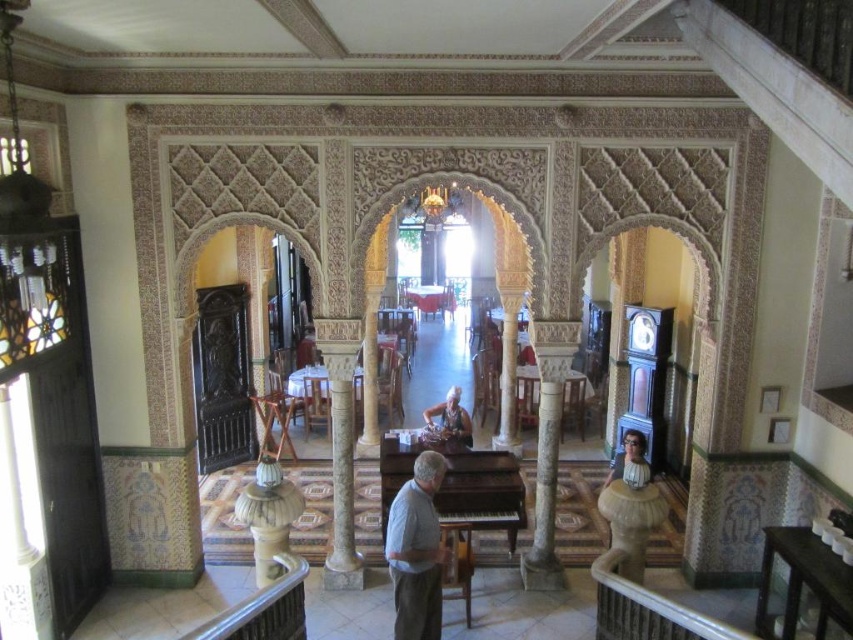
Question: Is gray cotton shirt at center wider than matte gray shirt at lower right?

Choices:
 (A) yes
 (B) no

Answer: (A)

Question: Does matte brown hair at center have a smaller size compared to matte gray shirt at lower right?

Choices:
 (A) yes
 (B) no

Answer: (B)

Question: Which of the following is the farthest from the observer?

Choices:
 (A) matte brown hair at center
 (B) matte gray shirt at lower right

Answer: (A)

Question: Is gray cotton shirt at center bigger than matte brown hair at center?

Choices:
 (A) yes
 (B) no

Answer: (B)

Question: Considering the real-world distances, which object is farthest from the gray cotton shirt at center?

Choices:
 (A) matte brown hair at center
 (B) white marble pillar at center
 (C) matte gray shirt at lower right

Answer: (C)

Question: Considering the real-world distances, which object is farthest from the white marble pillar at center?

Choices:
 (A) gray cotton shirt at center
 (B) matte gray shirt at lower right

Answer: (A)